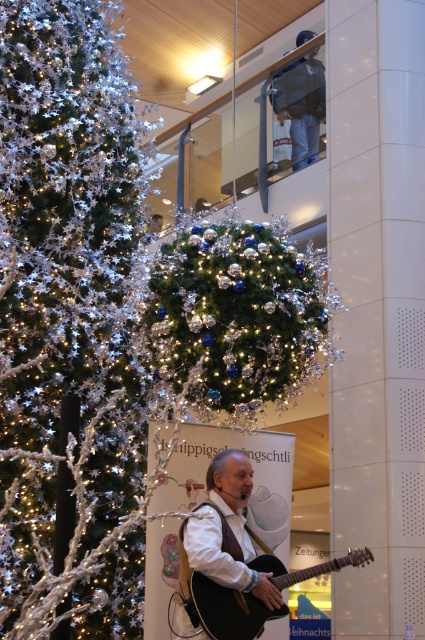
Looking at this image, you are a music teacher who wants to choose a guitar for a student. You have two options in the scene, the white matte guitar at center and the matte black guitar at center. Which one is bigger and more suitable for a taller student?

The white matte guitar at center is larger in size than the matte black guitar at center, so it is more suitable for a taller student.

You are standing at the center of the image. Which direction should you move to get closer to the white matte guitar at center?

Since the white matte guitar at center is already at the center of the image, you don not need to move in any direction to get closer to it. You are already at the optimal position.